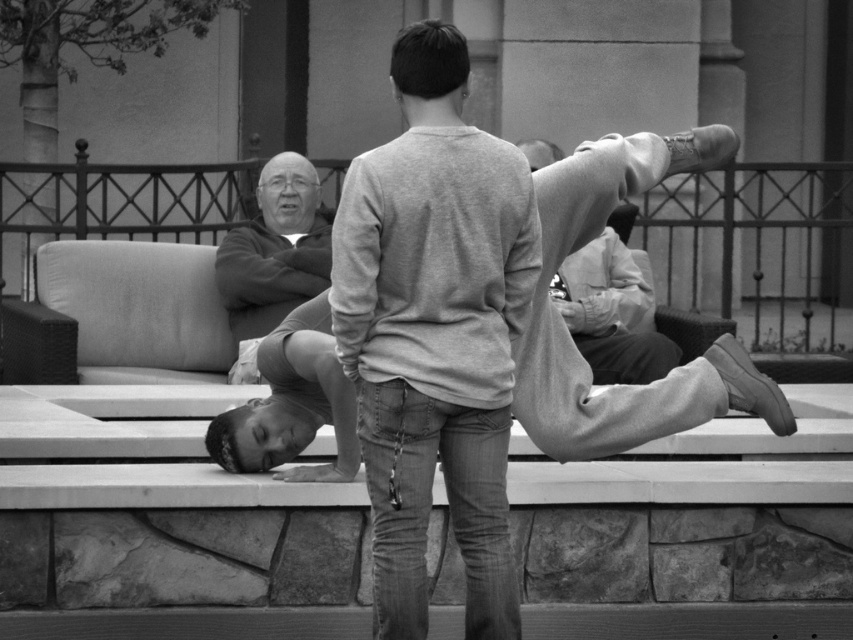
Question: In this image, where is smooth gray sweater at upper center located relative to smooth gray pants at center?

Choices:
 (A) left
 (B) right

Answer: (A)

Question: Can you confirm if smooth gray sweater at upper center is positioned to the right of smooth gray pants at center?

Choices:
 (A) yes
 (B) no

Answer: (B)

Question: Among these objects, which one is farthest from the camera?

Choices:
 (A) smooth gray sweater at upper center
 (B) smooth gray pants at center

Answer: (A)

Question: Does smooth gray sweater at upper center have a smaller size compared to smooth gray pants at center?

Choices:
 (A) no
 (B) yes

Answer: (B)

Question: Among these objects, which one is nearest to the camera?

Choices:
 (A) smooth gray pants at center
 (B) smooth gray sweater at upper center

Answer: (A)